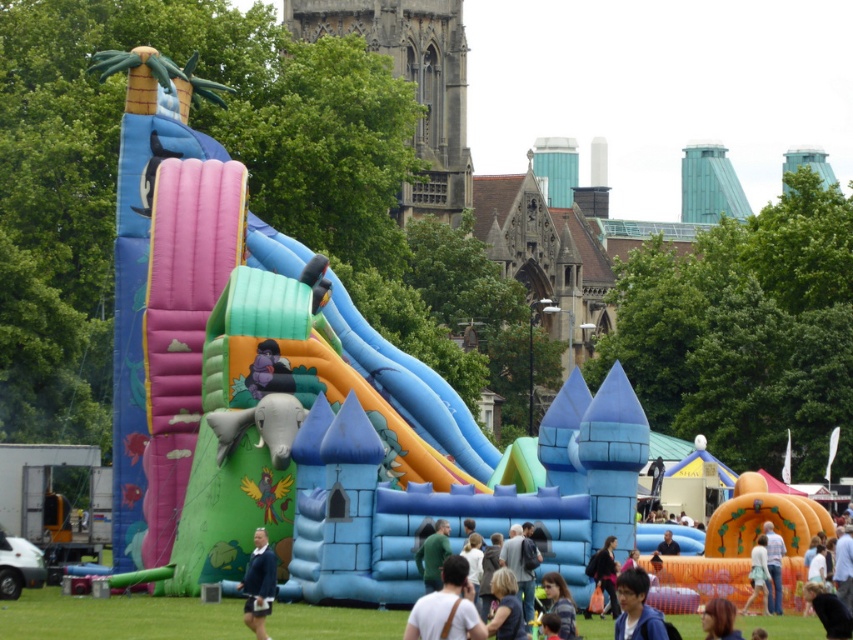
You are a photographer standing at the entrance of the bouncy castle. You see the light blue denim jacket at lower right and your camera. How far apart are they?

The light blue denim jacket at lower right and the camera are 89.47 meters apart.

You are a photographer capturing a child playing near the bouncy castle. You notice the dark brown hair at center and the light blue denim jeans at lower right in your frame. Which object is located higher in the image?

The dark brown hair at center is positioned over the light blue denim jeans at lower right, meaning it is higher in the image.

Looking at this image, you are at a party and see two people wearing the light brown leather jacket at center and the green matte shirt at center. If you are facing the same direction as the people, which one is on your left?

The green matte shirt at center is on the left because the light brown leather jacket at center is to the right of it.